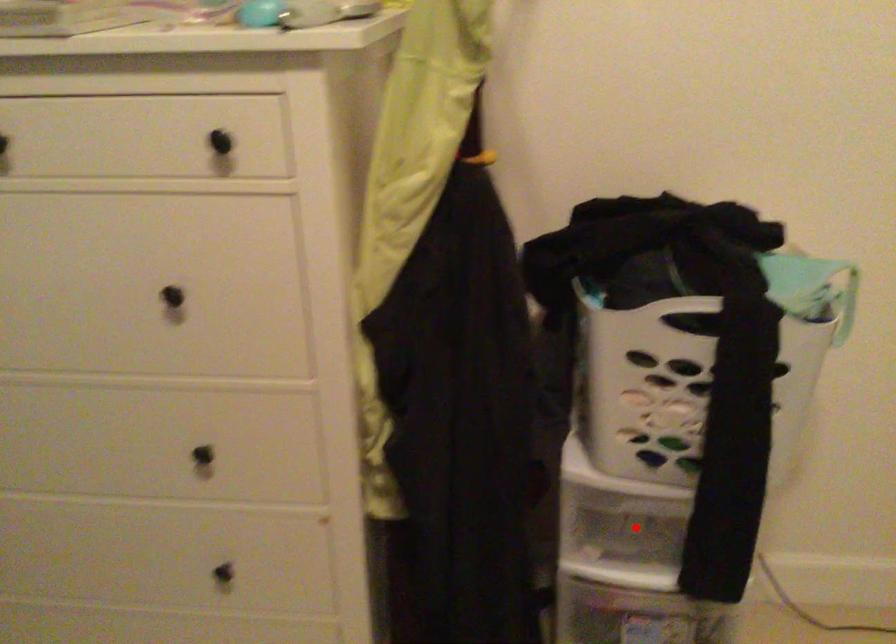
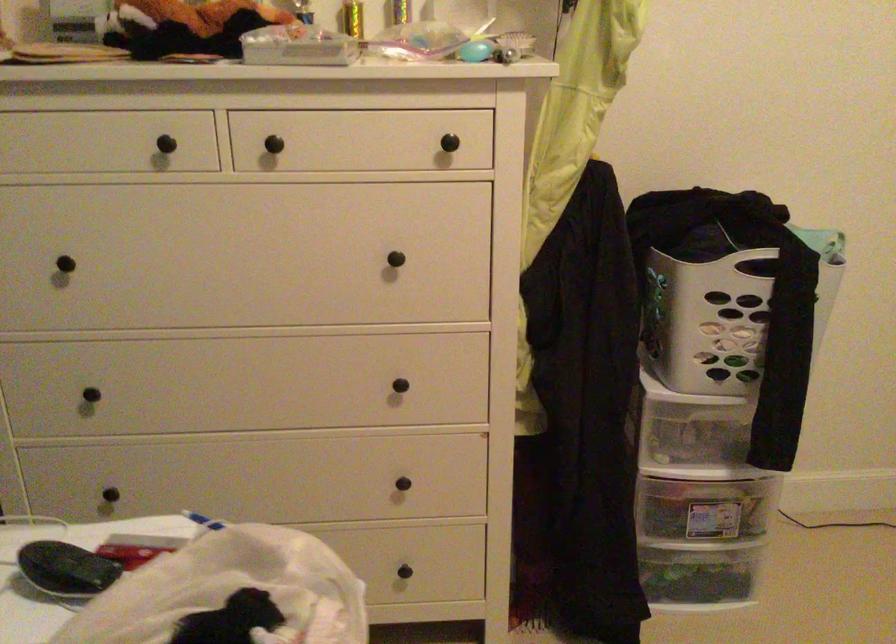
Where in the second image is the point corresponding to the highlighted location from the first image?

(695, 438)